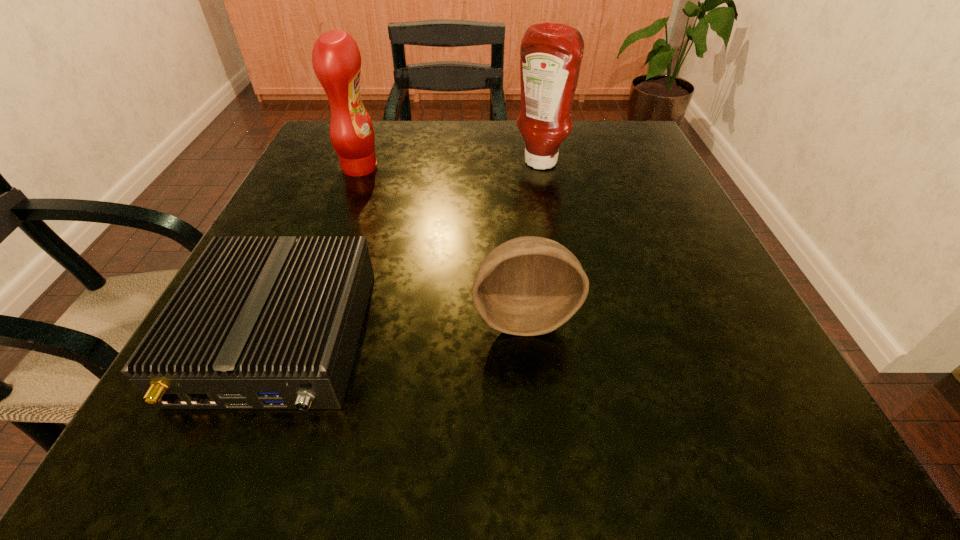
This screenshot has width=960, height=540. Find the location of `vacant region between the right condiment and the left condiment`. vacant region between the right condiment and the left condiment is located at coordinates (450, 166).

You are a GUI agent. You are given a task and a screenshot of the screen. Output one action in this format:
    pyautogui.click(x=<x>, y=<y>)
    Task: Click on the vacant space that's between the second shortest object and the shortest object
    
    Given the screenshot: What is the action you would take?
    402,327

Where is `vacant area that lies between the right condiment and the left condiment`? The width and height of the screenshot is (960, 540). vacant area that lies between the right condiment and the left condiment is located at coordinates (450, 166).

Where is `free space between the third tallest object and the left condiment`? free space between the third tallest object and the left condiment is located at coordinates (442, 242).

This screenshot has width=960, height=540. Identify the location of vacant area that lies between the right condiment and the left condiment. (450, 166).

This screenshot has width=960, height=540. Find the location of `empty space between the bowl and the left condiment`. empty space between the bowl and the left condiment is located at coordinates (442, 242).

Identify which object is located as the second nearest to the router. Please provide its 2D coordinates. Your answer should be formatted as a tuple, i.e. [(x, y)], where the tuple contains the x and y coordinates of a point satisfying the conditions above.

[(336, 59)]

What are the coordinates of `the second closest object to the right condiment` in the screenshot? It's located at (528, 286).

Find the location of a particular element. Image resolution: width=960 pixels, height=540 pixels. vacant region that satisfies the following two spatial constraints: 1. on the label side of the left condiment; 2. on the left side of the bowl is located at coordinates (302, 316).

In order to click on vacant space that satisfies the following two spatial constraints: 1. on the front side of the right condiment; 2. on the label side of the left condiment in this screenshot , I will do `click(541, 167)`.